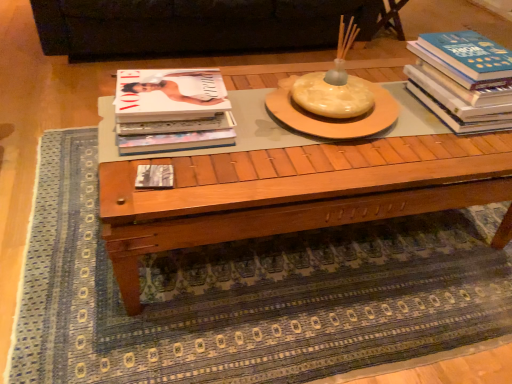
At what (x,y) coordinates should I click in order to perform the action: click on vacant space to the right of matte black book at center, arranged as the first book when viewed from the left. Please return your answer as a coordinate pair (x, y). Looking at the image, I should click on (216, 181).